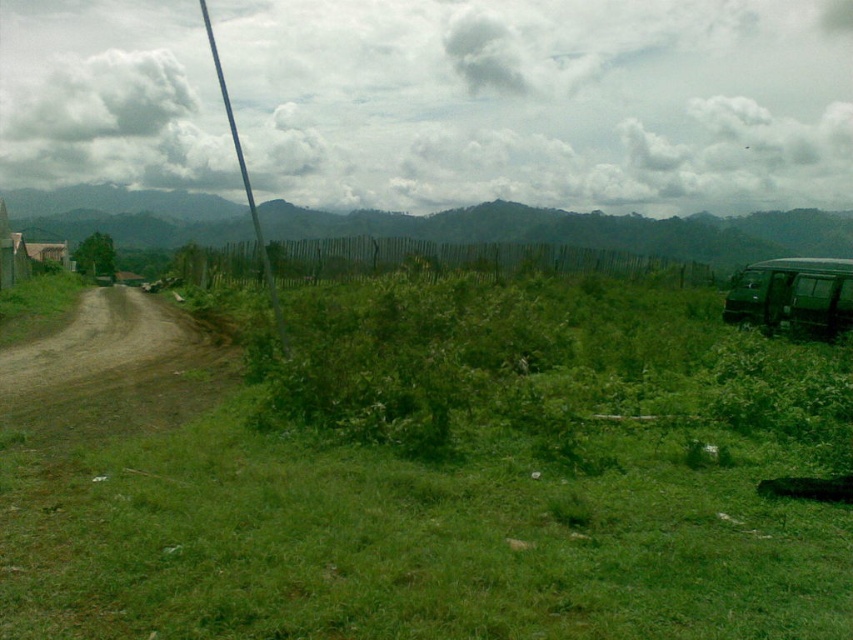
Question: Does brown dirt track at left appear on the left side of green matte van at right?

Choices:
 (A) yes
 (B) no

Answer: (A)

Question: Is green grass at center to the left of green matte van at right from the viewer's perspective?

Choices:
 (A) no
 (B) yes

Answer: (B)

Question: Which object is positioned farthest from the green matte van at right?

Choices:
 (A) green grass at center
 (B) brown dirt track at left

Answer: (B)

Question: Which of these objects is positioned closest to the green grass at center?

Choices:
 (A) brown dirt track at left
 (B) green matte van at right

Answer: (A)

Question: Which point is closer to the camera?

Choices:
 (A) (67, 387)
 (B) (805, 308)

Answer: (A)

Question: Is green grass at center above green matte van at right?

Choices:
 (A) no
 (B) yes

Answer: (A)